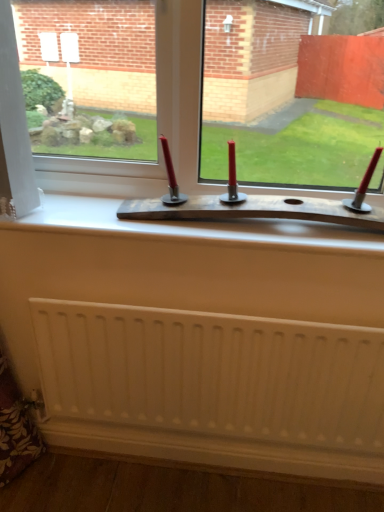
Question: From the image's perspective, is wooden board at center above or below white matte radiator at lower center?

Choices:
 (A) below
 (B) above

Answer: (B)

Question: Is wooden board at center situated inside white matte radiator at lower center or outside?

Choices:
 (A) outside
 (B) inside

Answer: (A)

Question: Looking at the image, does wooden board at center seem bigger or smaller compared to white matte radiator at lower center?

Choices:
 (A) small
 (B) big

Answer: (B)

Question: Is white matte radiator at lower center situated inside wooden board at center or outside?

Choices:
 (A) outside
 (B) inside

Answer: (A)

Question: From the image's perspective, is white matte radiator at lower center positioned above or below wooden board at center?

Choices:
 (A) below
 (B) above

Answer: (A)

Question: Visually, is white matte radiator at lower center positioned to the left or to the right of wooden board at center?

Choices:
 (A) left
 (B) right

Answer: (B)

Question: Considering the positions of point (299, 415) and point (157, 80), is point (299, 415) closer or farther from the camera than point (157, 80)?

Choices:
 (A) farther
 (B) closer

Answer: (A)